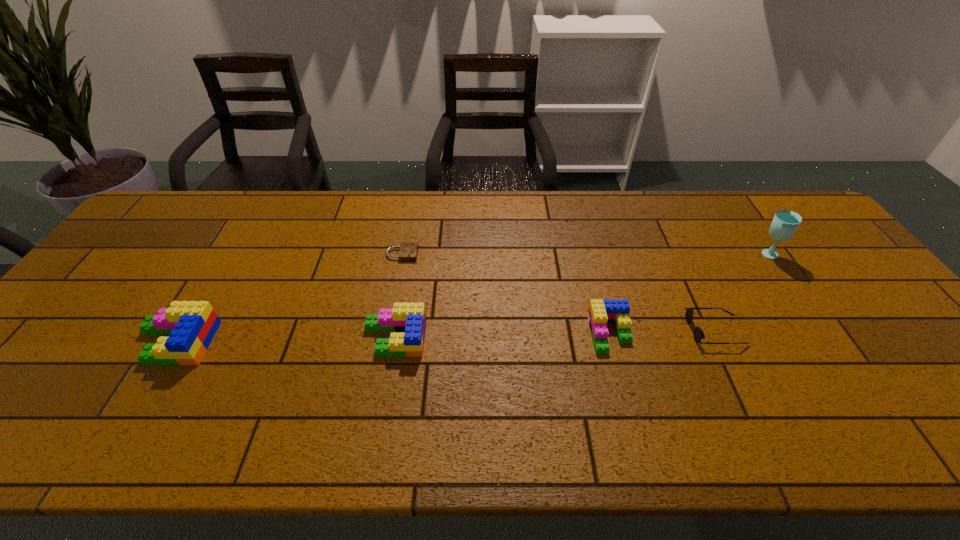
All Legos are currently evenly spaced. To continue this pattern, where would you add another Lego on the right? Please point out a vacant spot. Please provide its 2D coordinates. Your answer should be formatted as a tuple, i.e. [(x, y)], where the tuple contains the x and y coordinates of a point satisfying the conditions above.

[(821, 329)]